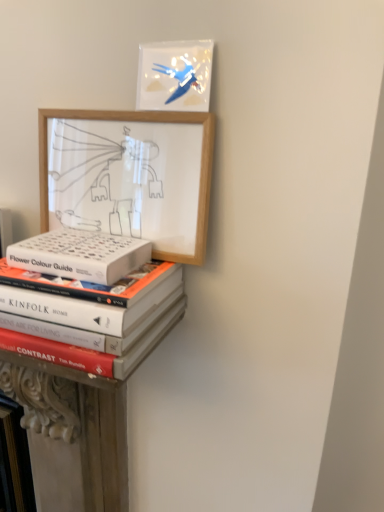
The height and width of the screenshot is (512, 384). In order to click on vacant space situated above hardcover books at lower left (from a real-world perspective) in this screenshot , I will do `click(83, 280)`.